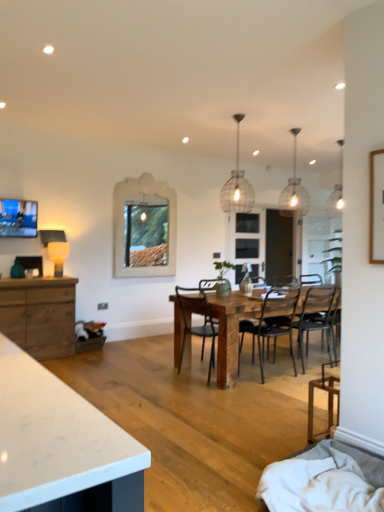
Question: Does black metal chair at center, which is the second chair in back-to-front order, have a lesser height compared to woven wire pendant light at center, marked as the third light fixture in a back-to-front arrangement?

Choices:
 (A) no
 (B) yes

Answer: (B)

Question: Considering the relative sizes of black metal chair at center, which is the second chair in back-to-front order, and woven wire pendant light at center, marked as the third light fixture in a back-to-front arrangement, in the image provided, is black metal chair at center, which is the second chair in back-to-front order, thinner than woven wire pendant light at center, marked as the third light fixture in a back-to-front arrangement,?

Choices:
 (A) no
 (B) yes

Answer: (A)

Question: Is black metal chair at center, which appears as the 3th chair when viewed from the front, positioned behind woven wire pendant light at center, which appears as the 1th light fixture when viewed from the left?

Choices:
 (A) no
 (B) yes

Answer: (A)

Question: Are black metal chair at center, which appears as the 3th chair when viewed from the front, and woven wire pendant light at center, marked as the third light fixture in a back-to-front arrangement, beside each other?

Choices:
 (A) no
 (B) yes

Answer: (A)

Question: Is black metal chair at center, which appears as the 3th chair when viewed from the front, at the left side of woven wire pendant light at center, which appears as the 1th light fixture when viewed from the left?

Choices:
 (A) yes
 (B) no

Answer: (B)

Question: Would you say rustic wood table at center is inside or outside metallic black chair at center, which appears as the second chair when viewed from the front?

Choices:
 (A) inside
 (B) outside

Answer: (B)

Question: From a real-world perspective, is rustic wood table at center physically located above or below metallic black chair at center, which appears as the second chair when viewed from the front?

Choices:
 (A) above
 (B) below

Answer: (B)

Question: Does point (226, 372) appear closer or farther from the camera than point (175, 335)?

Choices:
 (A) closer
 (B) farther

Answer: (A)

Question: In terms of height, does rustic wood table at center look taller or shorter compared to metallic black chair at center, the 3th chair from the back?

Choices:
 (A) short
 (B) tall

Answer: (A)

Question: Considering the positions of point (44, 321) and point (52, 249), is point (44, 321) closer or farther from the camera than point (52, 249)?

Choices:
 (A) farther
 (B) closer

Answer: (B)

Question: In terms of width, does natural wood cabinet at left look wider or thinner when compared to matte white lampshade at left?

Choices:
 (A) wide
 (B) thin

Answer: (A)

Question: Relative to matte white lampshade at left, is natural wood cabinet at left in front or behind?

Choices:
 (A) behind
 (B) front

Answer: (B)

Question: From a real-world perspective, is natural wood cabinet at left positioned above or below matte white lampshade at left?

Choices:
 (A) below
 (B) above

Answer: (A)

Question: In terms of height, does wooden chair at lower right, the 4th chair in the back-to-front sequence, look taller or shorter compared to natural wood cabinet at left?

Choices:
 (A) tall
 (B) short

Answer: (B)

Question: Considering the positions of wooden chair at lower right, the 1th chair when ordered from front to back, and natural wood cabinet at left in the image, is wooden chair at lower right, the 1th chair when ordered from front to back, bigger or smaller than natural wood cabinet at left?

Choices:
 (A) small
 (B) big

Answer: (A)